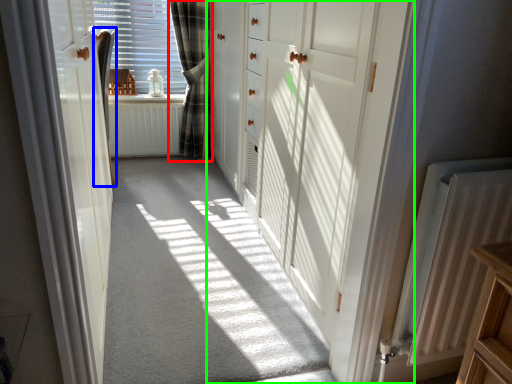
Question: Which object is the closest to the curtain (highlighted by a red box)? Choose among these: curtain (highlighted by a blue box) or door (highlighted by a green box).

Choices:
 (A) curtain
 (B) door

Answer: (A)